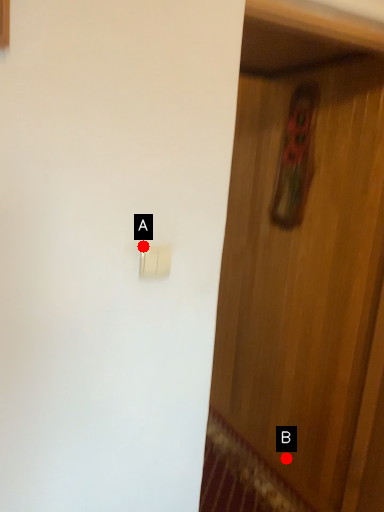
Question: Two points are circled on the image, labeled by A and B beside each circle. Among these points, which one is nearest to the camera?

Choices:
 (A) A is closer
 (B) B is closer

Answer: (A)